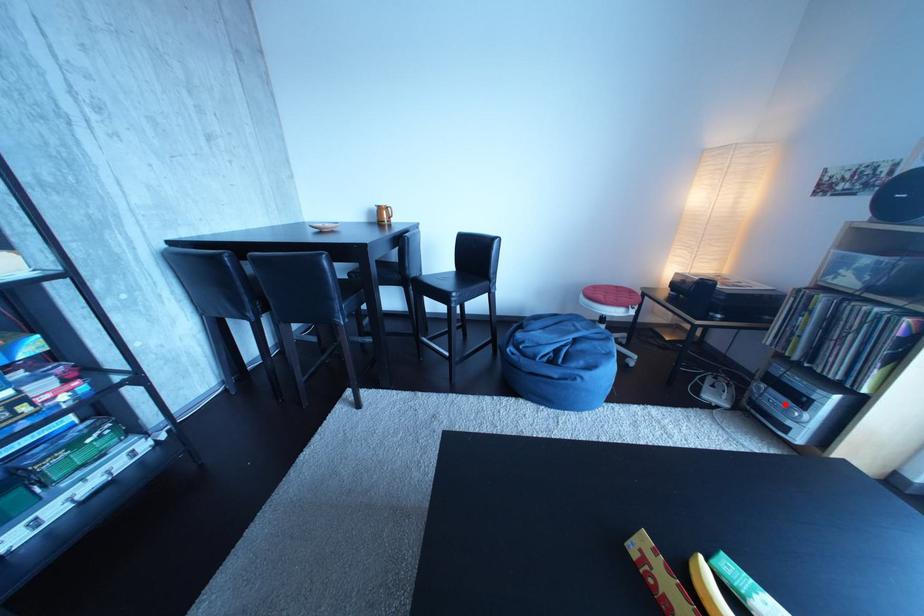
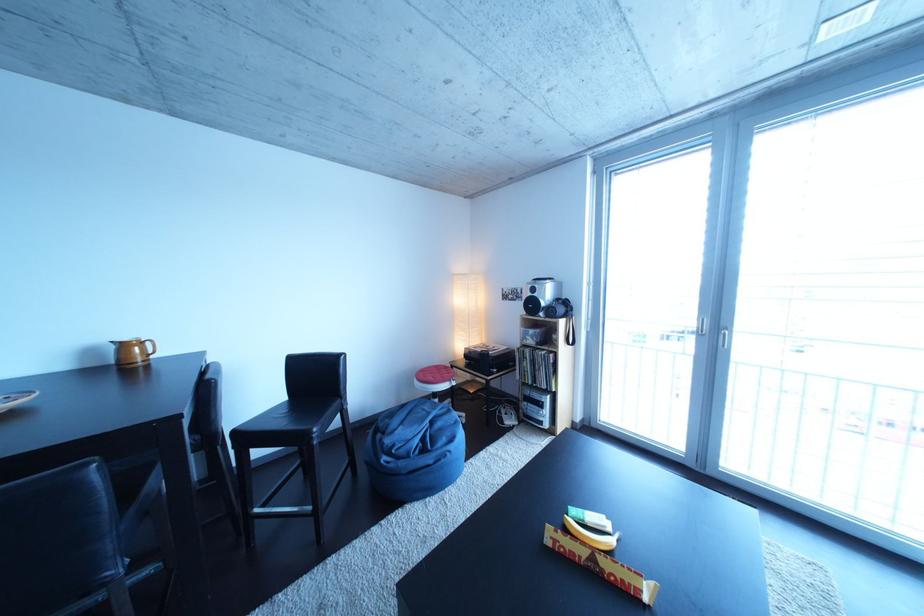
Question: I am providing you with two images of the same scene from different viewpoints. Given a red point in image1, look at the same physical point in image2. Is it:

Choices:
 (A) Closer to the viewpoint
 (B) Farther from the viewpoint

Answer: (B)